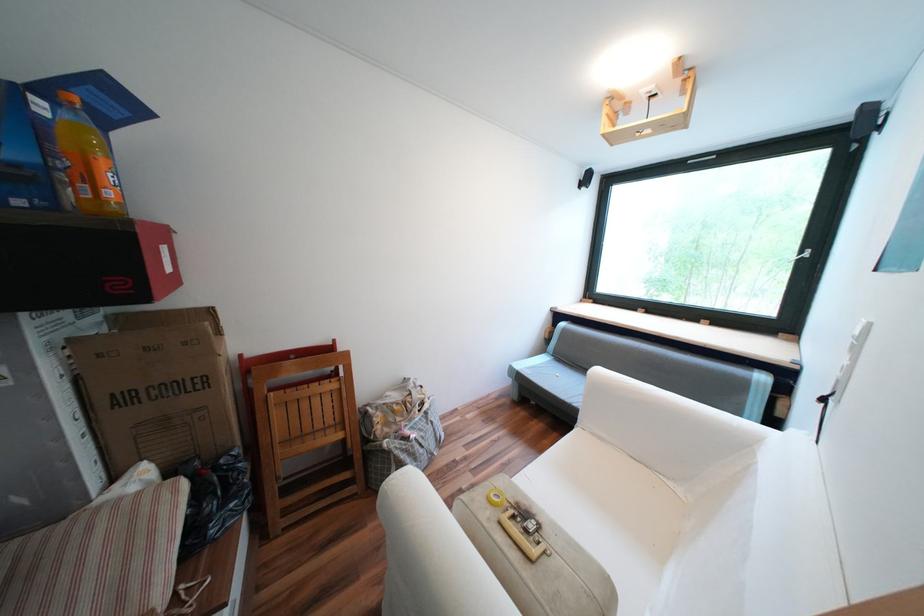
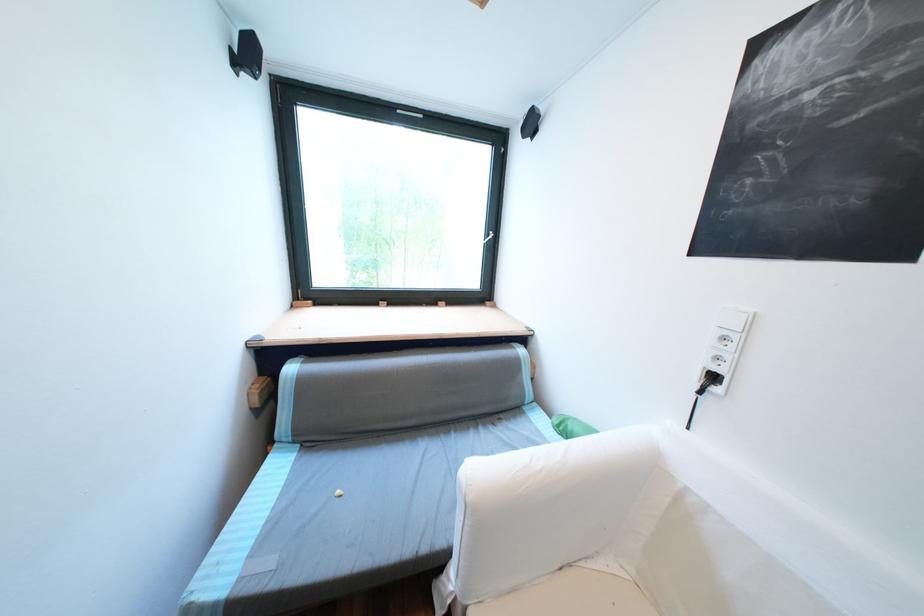
Locate, in the second image, the point that corresponds to point 585,405 in the first image.

(433, 549)